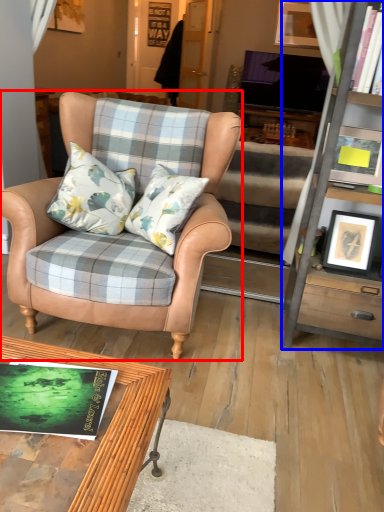
Question: Which object appears closest to the camera in this image, chair (highlighted by a red box) or cabinetry (highlighted by a blue box)?

Choices:
 (A) chair
 (B) cabinetry

Answer: (A)